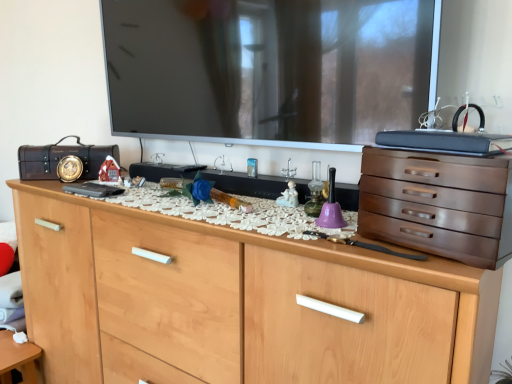
The width and height of the screenshot is (512, 384). Describe the element at coordinates (438, 204) in the screenshot. I see `satin brown chest of drawers at right, which is counted as the 2th chest of drawers, starting from the bottom` at that location.

You are a GUI agent. You are given a task and a screenshot of the screen. Output one action in this format:
    pyautogui.click(x=<x>, y=<y>)
    Task: Click on the light wood chest of drawers at center, which is counted as the second chest of drawers, starting from the top
    The height and width of the screenshot is (384, 512).
    Given the screenshot: What is the action you would take?
    pyautogui.click(x=238, y=302)

I want to click on matte black suitcase at left, so click(x=61, y=158).

Identify the location of chest of drawers below the white porcelain figurine at center (from a real-world perspective). (238, 302).

Looking at this image, is light wood chest of drawers at center, the first chest of drawers from the bottom, touching white porcelain figurine at center?

No, light wood chest of drawers at center, the first chest of drawers from the bottom, is not beside white porcelain figurine at center.

Between light wood chest of drawers at center, which is counted as the second chest of drawers, starting from the top, and white porcelain figurine at center, which one has larger size?

Bigger between the two is light wood chest of drawers at center, which is counted as the second chest of drawers, starting from the top.

Which object is closer to the camera taking this photo, light wood chest of drawers at center, the first chest of drawers from the bottom, or white porcelain figurine at center?

Positioned in front is light wood chest of drawers at center, the first chest of drawers from the bottom.

Based on the photo, does white porcelain figurine at center appear on the right side of matte black suitcase at left?

Yes.

Who is taller, white porcelain figurine at center or matte black suitcase at left?

matte black suitcase at left is taller.

Could matte black suitcase at left be considered to be inside white porcelain figurine at center?

No, matte black suitcase at left is not a part of white porcelain figurine at center.

From a real-world perspective, starting from the white matte table at lower left, which chest of drawers is the 1st one vertically above it? Please provide its 2D coordinates.

[(238, 302)]

How different are the orientations of light wood chest of drawers at center, the first chest of drawers from the bottom, and white matte table at lower left in degrees?

The angle between the facing direction of light wood chest of drawers at center, the first chest of drawers from the bottom, and the facing direction of white matte table at lower left is 1.71 degrees.

Does light wood chest of drawers at center, which is counted as the second chest of drawers, starting from the top, have a lesser width compared to white matte table at lower left?

No.

From the image's perspective, is light wood chest of drawers at center, which is counted as the second chest of drawers, starting from the top, beneath white matte table at lower left?

No, from the image's perspective, light wood chest of drawers at center, which is counted as the second chest of drawers, starting from the top, is not beneath white matte table at lower left.

From the picture: From the image's perspective, is white porcelain figurine at center beneath satin brown chest of drawers at right, which is counted as the first chest of drawers, starting from the top?

Actually, white porcelain figurine at center appears above satin brown chest of drawers at right, which is counted as the first chest of drawers, starting from the top, in the image.

Between white porcelain figurine at center and satin brown chest of drawers at right, which is counted as the first chest of drawers, starting from the top, which one is positioned in front?

satin brown chest of drawers at right, which is counted as the first chest of drawers, starting from the top, is closer to the camera.

Does point (294, 190) come behind point (470, 205)?

That is True.

Locate an element on the screen. This screenshot has width=512, height=384. toy behind the satin brown chest of drawers at right, which is counted as the 2th chest of drawers, starting from the bottom is located at coordinates (288, 196).

Which object is positioned more to the right, light wood chest of drawers at center, which is counted as the second chest of drawers, starting from the top, or satin brown chest of drawers at right, which is counted as the 2th chest of drawers, starting from the bottom?

satin brown chest of drawers at right, which is counted as the 2th chest of drawers, starting from the bottom.

Is light wood chest of drawers at center, which is counted as the second chest of drawers, starting from the top, far away from satin brown chest of drawers at right, which is counted as the 2th chest of drawers, starting from the bottom?

No, light wood chest of drawers at center, which is counted as the second chest of drawers, starting from the top, is in close proximity to satin brown chest of drawers at right, which is counted as the 2th chest of drawers, starting from the bottom.

How distant is light wood chest of drawers at center, which is counted as the second chest of drawers, starting from the top, from satin brown chest of drawers at right, which is counted as the first chest of drawers, starting from the top?

They are 15.40 inches apart.

Between point (239, 330) and point (396, 206), which one is positioned behind?

The point (239, 330) is farther.

Does point (496, 174) appear closer or farther from the camera than point (6, 337)?

Point (496, 174).

Which is in front, satin brown chest of drawers at right, which is counted as the first chest of drawers, starting from the top, or white matte table at lower left?

satin brown chest of drawers at right, which is counted as the first chest of drawers, starting from the top, is in front.

Is satin brown chest of drawers at right, which is counted as the 2th chest of drawers, starting from the bottom, not near white matte table at lower left?

Yes.

From a real-world perspective, is satin brown chest of drawers at right, which is counted as the 2th chest of drawers, starting from the bottom, positioned under white porcelain figurine at center based on gravity?

No, from a real-world perspective, satin brown chest of drawers at right, which is counted as the 2th chest of drawers, starting from the bottom, is not under white porcelain figurine at center.

What's the angular difference between satin brown chest of drawers at right, which is counted as the first chest of drawers, starting from the top, and white porcelain figurine at center's facing directions?

12.3 degrees separate the facing orientations of satin brown chest of drawers at right, which is counted as the first chest of drawers, starting from the top, and white porcelain figurine at center.

Is satin brown chest of drawers at right, which is counted as the first chest of drawers, starting from the top, oriented away from white porcelain figurine at center?

No, satin brown chest of drawers at right, which is counted as the first chest of drawers, starting from the top, is not facing away from white porcelain figurine at center.

Find the location of a particular element. The image size is (512, 384). chest of drawers on the right side of white porcelain figurine at center is located at coordinates (438, 204).

Where is `toy that appears behind the light wood chest of drawers at center, the first chest of drawers from the bottom`? This screenshot has height=384, width=512. toy that appears behind the light wood chest of drawers at center, the first chest of drawers from the bottom is located at coordinates (288, 196).

In order to click on radio that is above the white porcelain figurine at center (from the image's perspective) in this screenshot , I will do `click(61, 158)`.

Which object lies further to the anchor point white matte table at lower left, satin brown chest of drawers at right, which is counted as the 2th chest of drawers, starting from the bottom, or light wood chest of drawers at center, which is counted as the second chest of drawers, starting from the top?

satin brown chest of drawers at right, which is counted as the 2th chest of drawers, starting from the bottom.

Considering their positions, is white porcelain figurine at center positioned closer to matte black suitcase at left than white matte table at lower left?

Based on the image, white matte table at lower left appears to be nearer to matte black suitcase at left.

Considering their positions, is matte black suitcase at left positioned further to light wood chest of drawers at center, the first chest of drawers from the bottom, than white porcelain figurine at center?

white porcelain figurine at center.

Based on their spatial positions, is white matte table at lower left or light wood chest of drawers at center, the first chest of drawers from the bottom, closer to white porcelain figurine at center?

light wood chest of drawers at center, the first chest of drawers from the bottom, is positioned closer to the anchor white porcelain figurine at center.

Based on the photo, when comparing their distances from light wood chest of drawers at center, the first chest of drawers from the bottom, does white porcelain figurine at center or white matte table at lower left seem closer?

white porcelain figurine at center is positioned closer to the anchor light wood chest of drawers at center, the first chest of drawers from the bottom.

Based on their spatial positions, is satin brown chest of drawers at right, which is counted as the first chest of drawers, starting from the top, or white matte table at lower left further from white porcelain figurine at center?

Among the two, white matte table at lower left is located further to white porcelain figurine at center.

Looking at the image, which one is located closer to matte black suitcase at left, light wood chest of drawers at center, the first chest of drawers from the bottom, or white porcelain figurine at center?

light wood chest of drawers at center, the first chest of drawers from the bottom, is closer to matte black suitcase at left.

Which object lies further to the anchor point satin brown chest of drawers at right, which is counted as the first chest of drawers, starting from the top, matte black suitcase at left or white porcelain figurine at center?

matte black suitcase at left is positioned further to the anchor satin brown chest of drawers at right, which is counted as the first chest of drawers, starting from the top.

This screenshot has width=512, height=384. I want to click on radio between white matte table at lower left and white porcelain figurine at center in the horizontal direction, so click(x=61, y=158).

Locate an element on the screen. table located between light wood chest of drawers at center, the first chest of drawers from the bottom, and matte black suitcase at left in the depth direction is located at coordinates (17, 359).

The width and height of the screenshot is (512, 384). Find the location of `the chest of drawers situated between white matte table at lower left and satin brown chest of drawers at right, which is counted as the first chest of drawers, starting from the top, from left to right`. the chest of drawers situated between white matte table at lower left and satin brown chest of drawers at right, which is counted as the first chest of drawers, starting from the top, from left to right is located at coordinates pos(238,302).

Locate an element on the screen. radio between white matte table at lower left and satin brown chest of drawers at right, which is counted as the first chest of drawers, starting from the top is located at coordinates (61, 158).